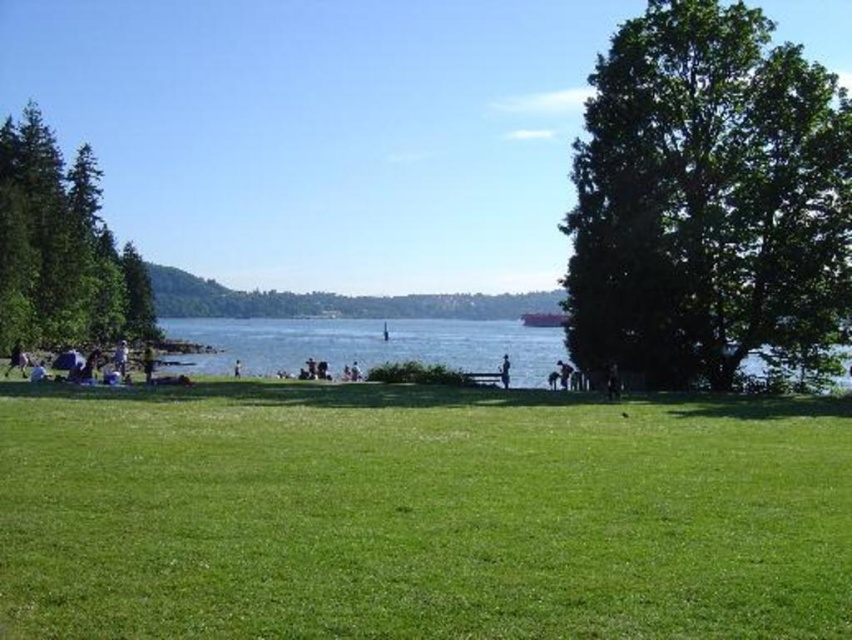
Question: Can you confirm if dark blue jeans at center is bigger than light blue jeans at center?

Choices:
 (A) yes
 (B) no

Answer: (B)

Question: Which object is farther from the camera taking this photo?

Choices:
 (A) light blue jeans at center
 (B) green leafy tree at right
 (C) green grassy field at center

Answer: (A)

Question: Which point is closer to the camera?

Choices:
 (A) green leafy tree at right
 (B) blue water at center
 (C) light brown wooden bench at center

Answer: (A)

Question: Is green leafy tree at right to the left of blue water at center from the viewer's perspective?

Choices:
 (A) no
 (B) yes

Answer: (A)

Question: Based on their relative distances, which object is nearer to the dark blue jeans at center?

Choices:
 (A) light brown wooden bench at center
 (B) light blue jeans at center
 (C) blue water at center

Answer: (B)

Question: Does yellow fabric person at lower left lie behind light brown wooden bench at center?

Choices:
 (A) yes
 (B) no

Answer: (B)